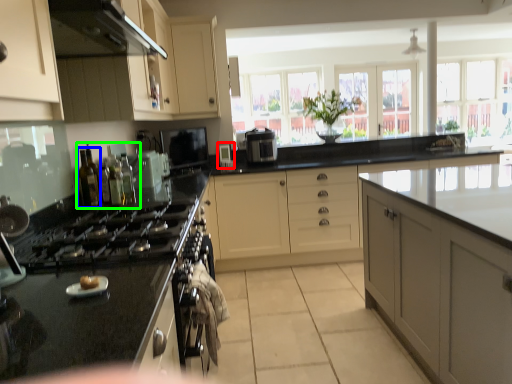
Question: Estimate the real-world distances between objects in this image. Which object is farther from appliance (highlighted by a red box), bottle (highlighted by a blue box) or bottle (highlighted by a green box)?

Choices:
 (A) bottle
 (B) bottle

Answer: (A)